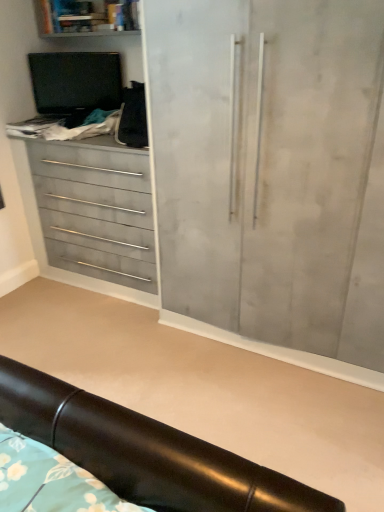
Question: Relative to matte gray cupboard at center, is black leather headboard at lower center in front or behind?

Choices:
 (A) behind
 (B) front

Answer: (A)

Question: Would you say black leather headboard at lower center is to the left or to the right of matte gray cupboard at center in the picture?

Choices:
 (A) left
 (B) right

Answer: (A)

Question: Which object is the farthest from the matte gray drawers at left?

Choices:
 (A) matte gray shelf at upper left
 (B) matte gray cupboard at center
 (C) black leather headboard at lower center

Answer: (C)

Question: Considering the real-world distances, which object is closest to the black leather headboard at lower center?

Choices:
 (A) matte gray drawers at left
 (B) matte gray cupboard at center
 (C) matte gray shelf at upper left

Answer: (B)